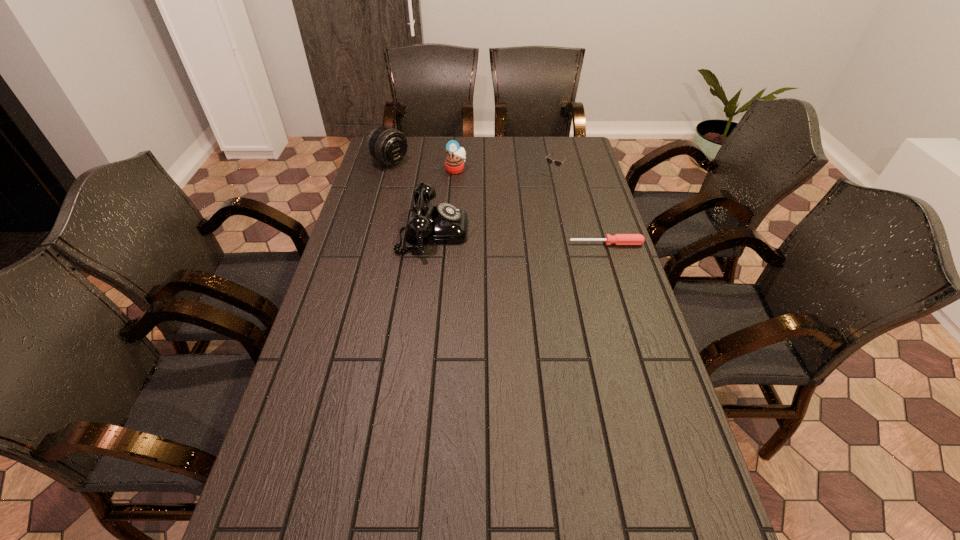
What are the coordinates of `free space that satisfies the following two spatial constraints: 1. on the front side of the muffin; 2. on the left side of the sunglasses` in the screenshot? It's located at (456, 173).

The image size is (960, 540). I want to click on free space that satisfies the following two spatial constraints: 1. on the front side of the fourth tallest object; 2. on the right side of the muffin, so [x=456, y=173].